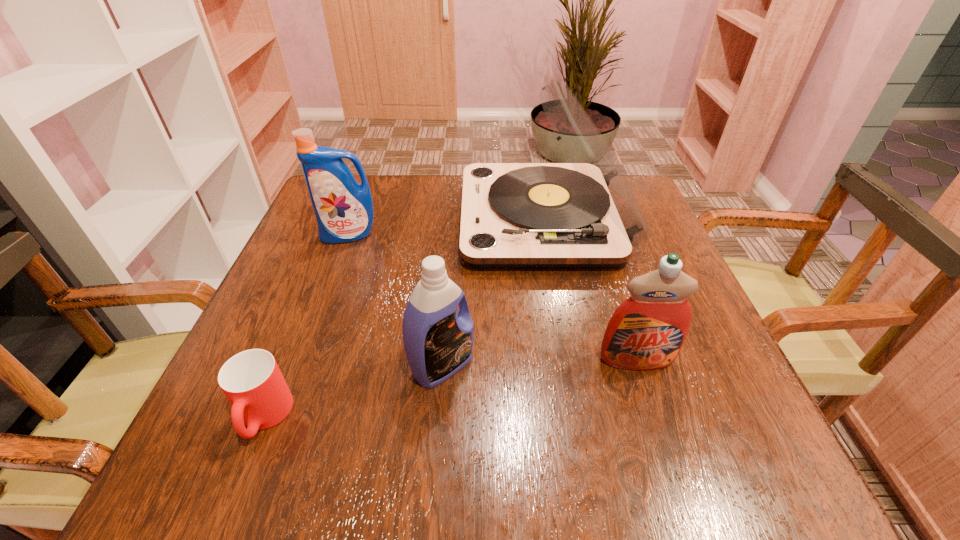
Where is `vacant region located on the front surface of the rightmost detergent`? vacant region located on the front surface of the rightmost detergent is located at coordinates point(649,399).

The image size is (960, 540). I want to click on record player present at the far edge, so click(x=584, y=214).

Where is `detergent situated at the far edge`? detergent situated at the far edge is located at coordinates (344, 211).

Locate an element on the screen. object at the near edge is located at coordinates (251, 380).

Where is `detergent at the left edge`? This screenshot has width=960, height=540. detergent at the left edge is located at coordinates (344, 211).

You are a GUI agent. You are given a task and a screenshot of the screen. Output one action in this format:
    pyautogui.click(x=<x>, y=<y>)
    Task: Click on the cup that is positioned at the left edge
    Image resolution: width=960 pixels, height=540 pixels.
    Given the screenshot: What is the action you would take?
    pyautogui.click(x=251, y=380)

Where is `record player present at the right edge`? record player present at the right edge is located at coordinates (584, 214).

Locate an element on the screen. detergent that is at the right edge is located at coordinates coord(646,332).

Image resolution: width=960 pixels, height=540 pixels. In order to click on object positioned at the far left corner in this screenshot , I will do `click(344, 211)`.

This screenshot has width=960, height=540. What are the coordinates of `object that is positioned at the near left corner` in the screenshot? It's located at (251, 380).